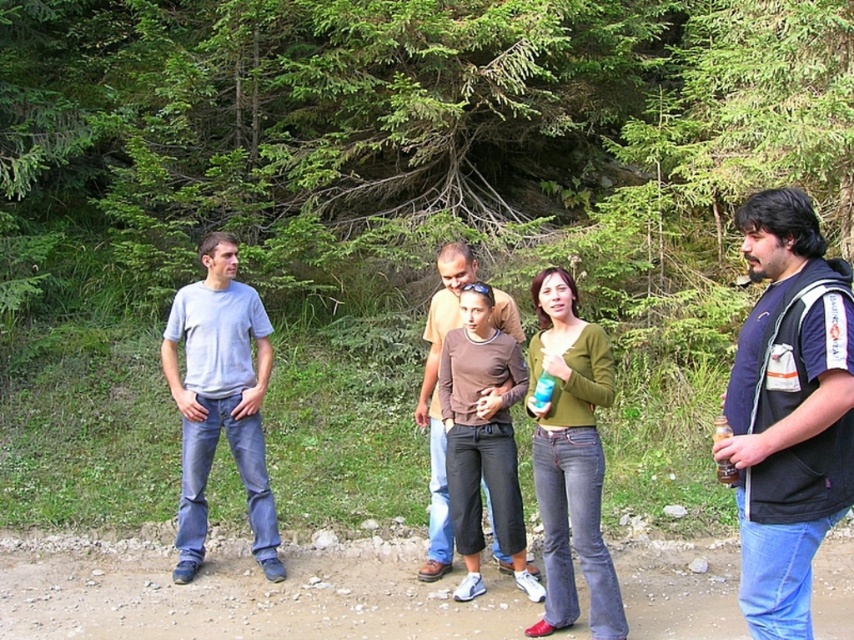
You are organizing a picnic and need to choose between the translucent plastic bottle at right and the blue plastic cup at center for holding water. Based on their sizes, which one would hold more water?

The translucent plastic bottle at right has a greater height compared to the blue plastic cup at center, so it can hold more water.